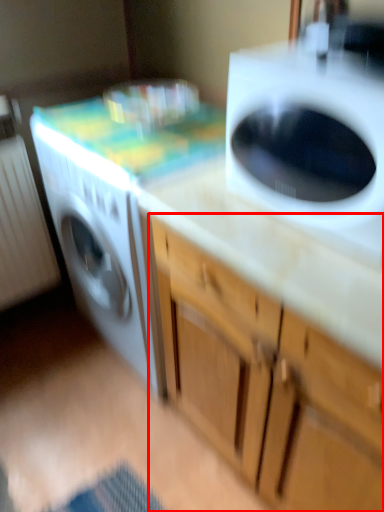
Question: Where is cabinetry (annotated by the red box) located in relation to washing machine in the image?

Choices:
 (A) right
 (B) left

Answer: (A)